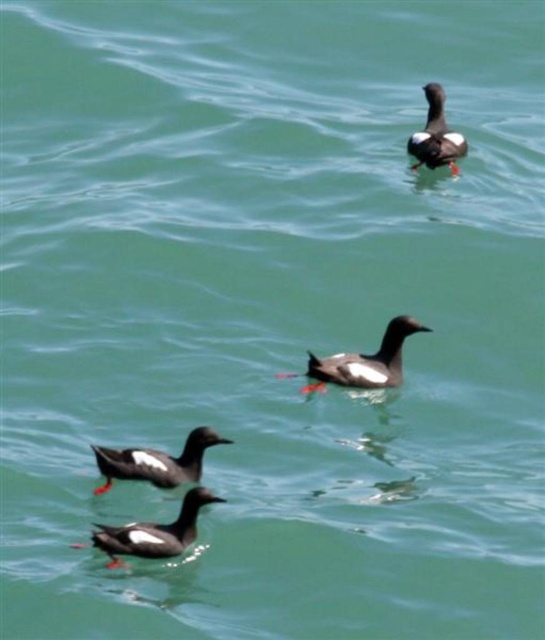
Is dark brown feathers at center above dark brown feathers at upper right?

No, dark brown feathers at center is not above dark brown feathers at upper right.

Consider the image. How much distance is there between dark brown feathers at center and dark brown feathers at upper right?

A distance of 11.26 feet exists between dark brown feathers at center and dark brown feathers at upper right.

The height and width of the screenshot is (640, 545). What do you see at coordinates (365, 362) in the screenshot? I see `dark brown feathers at center` at bounding box center [365, 362].

Where is `dark brown feathers at center`? dark brown feathers at center is located at coordinates (365, 362).

Who is positioned more to the left, dark brown matte duck at center or matte black duck at lower left?

dark brown matte duck at center is more to the left.

Between dark brown matte duck at center and matte black duck at lower left, which one is positioned higher?

Positioned higher is dark brown matte duck at center.

The image size is (545, 640). In order to click on dark brown matte duck at center in this screenshot , I will do `click(156, 461)`.

In order to click on dark brown matte duck at center in this screenshot , I will do `click(156, 461)`.

Between dark brown feathers at center and matte black duck at lower left, which one has more height?

Standing taller between the two is dark brown feathers at center.

Between point (386, 360) and point (168, 525), which one is positioned behind?

The point (386, 360) is behind.

Where is `dark brown feathers at center`? dark brown feathers at center is located at coordinates (365, 362).